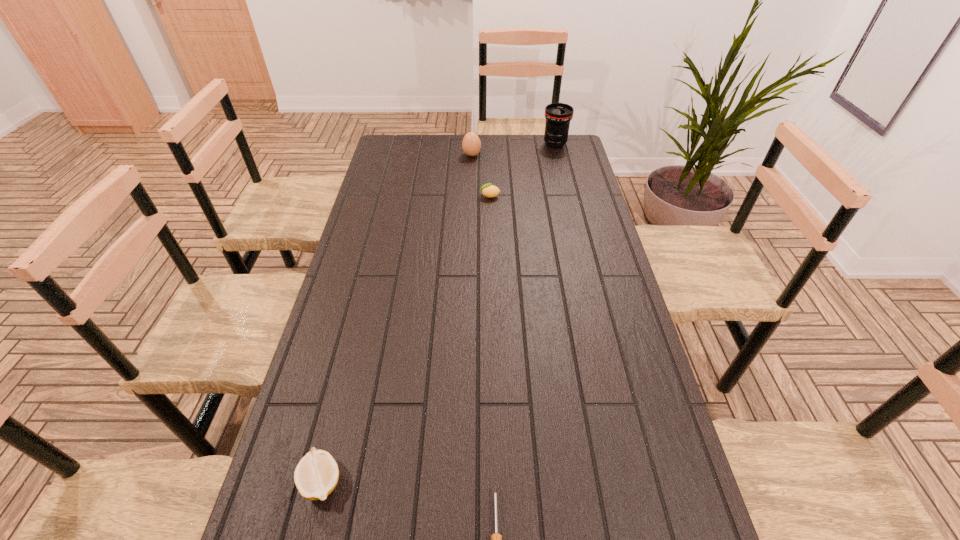
Where is `vacant space that satisfies the following two spatial constraints: 1. with leaves positioned above the right lemon; 2. on the front side of the nearer lemon`? vacant space that satisfies the following two spatial constraints: 1. with leaves positioned above the right lemon; 2. on the front side of the nearer lemon is located at coordinates (496, 481).

This screenshot has width=960, height=540. Find the location of `vacant region that satisfies the following two spatial constraints: 1. with leaves positioned above the third nearest object; 2. on the front side of the leftmost object`. vacant region that satisfies the following two spatial constraints: 1. with leaves positioned above the third nearest object; 2. on the front side of the leftmost object is located at coordinates (496, 481).